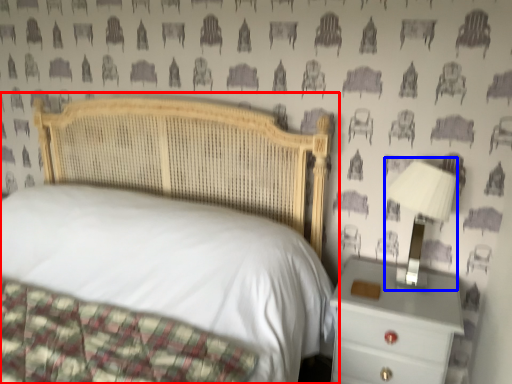
Question: Which point is closer to the camera, bed (highlighted by a red box) or bedside lamp (highlighted by a blue box)?

Choices:
 (A) bed
 (B) bedside lamp

Answer: (A)